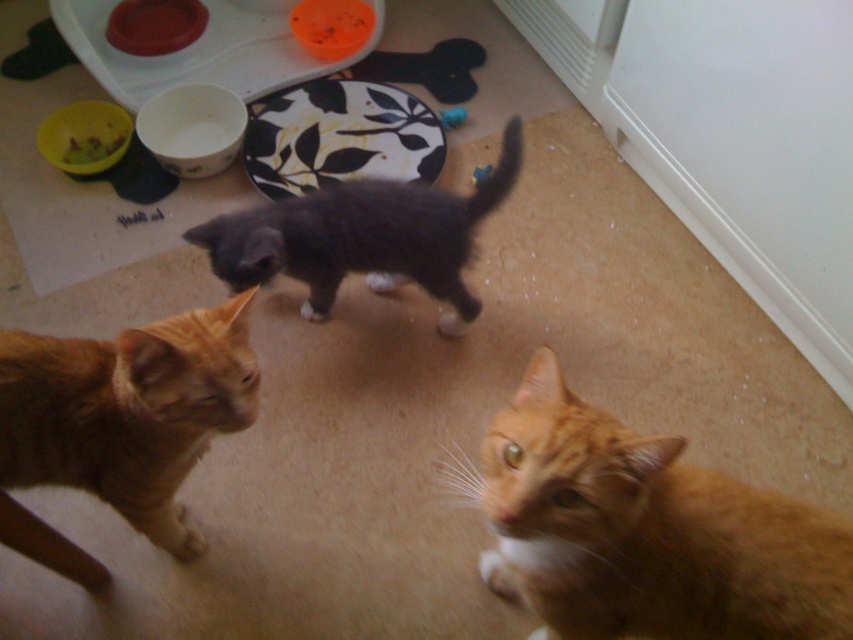
Does dark gray fur at center come in front of rubberized yellow bowl at upper left?

Yes, it is in front of rubberized yellow bowl at upper left.

Who is positioned more to the right, dark gray fur at center or rubberized yellow bowl at upper left?

dark gray fur at center is more to the right.

Describe the element at coordinates (363, 237) in the screenshot. I see `dark gray fur at center` at that location.

At what (x,y) coordinates should I click in order to perform the action: click on dark gray fur at center. Please return your answer as a coordinate pair (x, y). The width and height of the screenshot is (853, 640). Looking at the image, I should click on (363, 237).

Is point (537, 481) farther from viewer compared to point (473, 177)?

No, (537, 481) is closer to viewer.

Does orange fur cat at lower right have a lesser height compared to blue rubber ball at center?

In fact, orange fur cat at lower right may be taller than blue rubber ball at center.

Image resolution: width=853 pixels, height=640 pixels. In order to click on orange fur cat at lower right in this screenshot , I will do `click(646, 532)`.

Can you confirm if dark gray fur at center is positioned to the right of blue rubber toy at center?

Incorrect, dark gray fur at center is not on the right side of blue rubber toy at center.

Looking at this image, can you confirm if dark gray fur at center is smaller than blue rubber toy at center?

No.

Find the location of `dark gray fur at center`. dark gray fur at center is located at coordinates (363, 237).

At what (x,y) coordinates should I click in order to perform the action: click on dark gray fur at center. Please return your answer as a coordinate pair (x, y). Looking at the image, I should click on (363, 237).